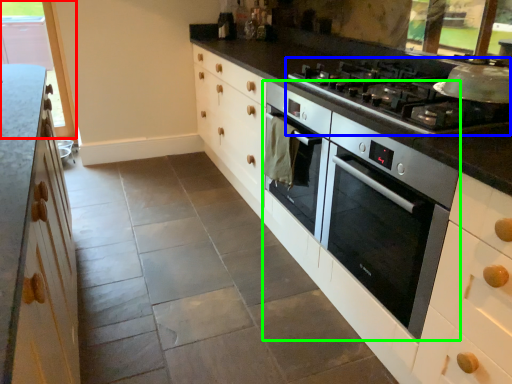
Question: Estimate the real-world distances between objects in this image. Which object is closer to window (highlighted by a red box), gas stove (highlighted by a blue box) or home appliance (highlighted by a green box)?

Choices:
 (A) gas stove
 (B) home appliance

Answer: (A)